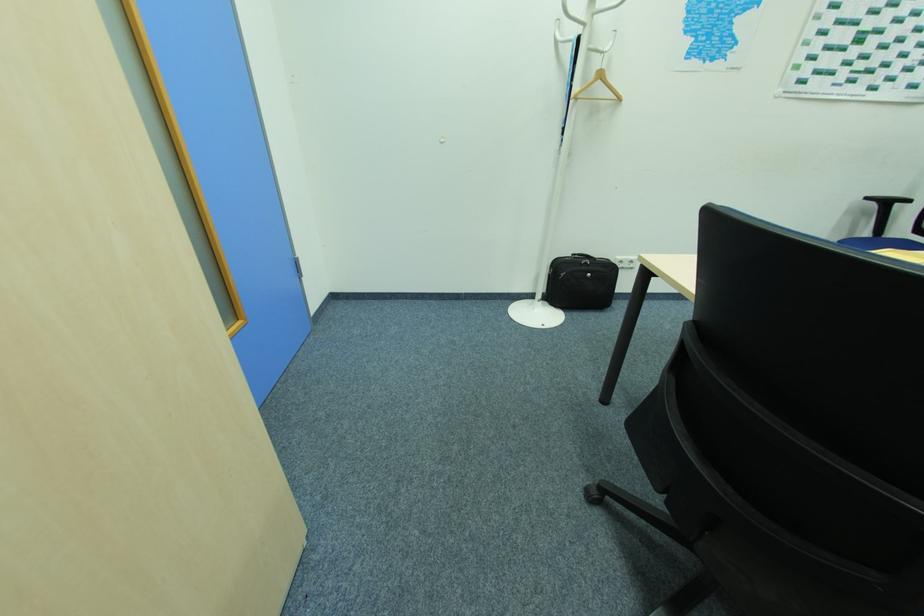
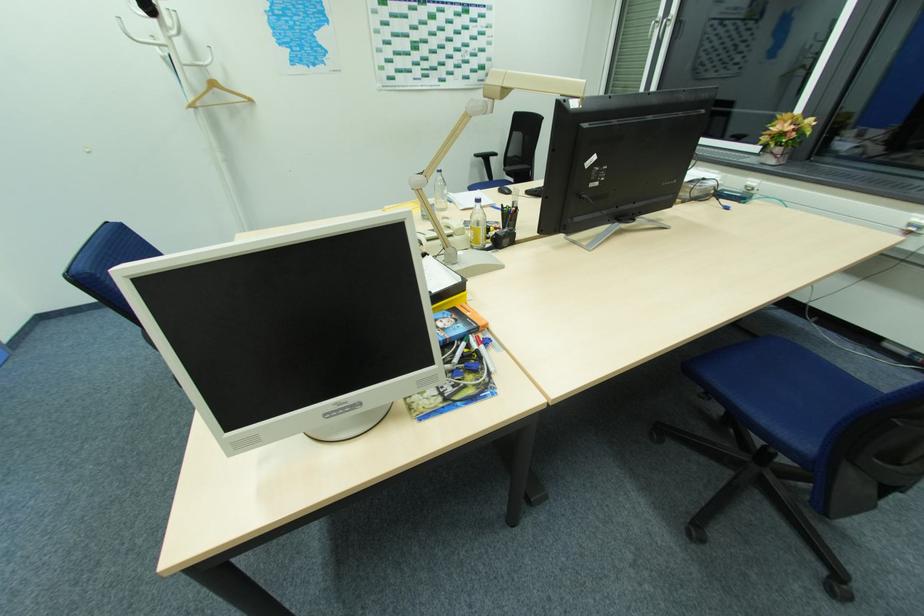
What movement of the cameraman would produce the second image?

The movement direction of the cameraman is right, backward.